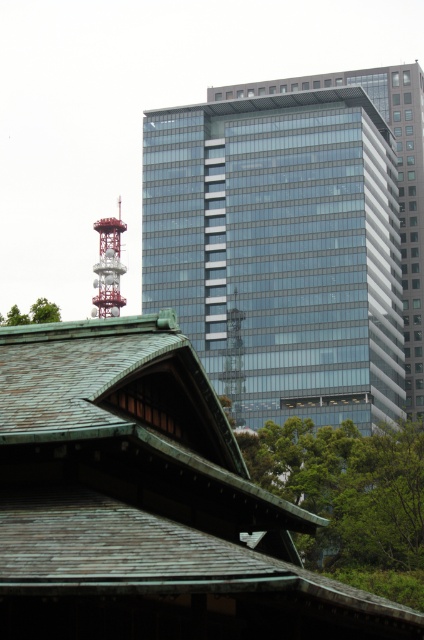
Question: Does green leafy tree at center appear under red painted metal tokyo tower at upper left?

Choices:
 (A) no
 (B) yes

Answer: (B)

Question: Which point appears farthest from the camera in this image?

Choices:
 (A) 337,490
 (B) 111,304

Answer: (B)

Question: Does green leafy tree at center appear on the right side of red painted metal tokyo tower at upper left?

Choices:
 (A) no
 (B) yes

Answer: (B)

Question: Estimate the real-world distances between objects in this image. Which object is farther from the red painted metal tokyo tower at upper left?

Choices:
 (A) green leafy tree at center
 (B) green leafy tree at upper left
 (C) glassy reflective building at center

Answer: (A)

Question: Among these objects, which one is nearest to the camera?

Choices:
 (A) red painted metal tokyo tower at upper left
 (B) green leafy tree at upper left

Answer: (B)

Question: Considering the relative positions of glassy reflective building at center and green leafy tree at upper left in the image provided, where is glassy reflective building at center located with respect to green leafy tree at upper left?

Choices:
 (A) left
 (B) right

Answer: (B)